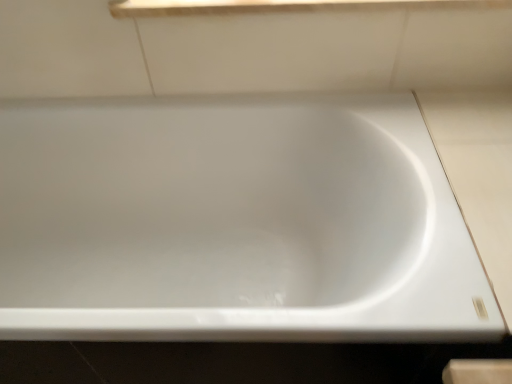
Question: From their relative heights in the image, would you say white glossy window sill at upper center is taller or shorter than white glossy bathtub at center?

Choices:
 (A) short
 (B) tall

Answer: (A)

Question: In the image, is white glossy window sill at upper center on the left side or the right side of white glossy bathtub at center?

Choices:
 (A) left
 (B) right

Answer: (B)

Question: Is point (279, 8) positioned closer to the camera than point (330, 256)?

Choices:
 (A) closer
 (B) farther

Answer: (A)

Question: Choose the correct answer: Is white glossy bathtub at center inside white glossy window sill at upper center or outside it?

Choices:
 (A) inside
 (B) outside

Answer: (B)

Question: Considering the relative positions of white glossy bathtub at center and white glossy window sill at upper center in the image provided, is white glossy bathtub at center to the left or to the right of white glossy window sill at upper center?

Choices:
 (A) left
 (B) right

Answer: (A)

Question: From a real-world perspective, is white glossy bathtub at center positioned above or below white glossy window sill at upper center?

Choices:
 (A) below
 (B) above

Answer: (A)

Question: In the image, is white glossy bathtub at center positioned in front of or behind white glossy window sill at upper center?

Choices:
 (A) front
 (B) behind

Answer: (A)